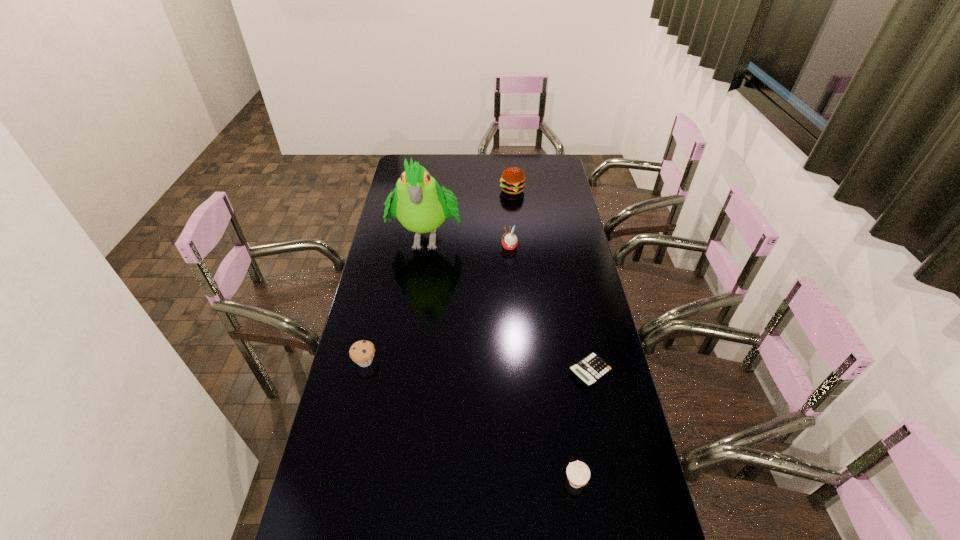
At what (x,y) coordinates should I click in order to perform the action: click on free space that satisfies the following two spatial constraints: 1. on the beak of the parakeet; 2. on the left side of the calculator. Please return your answer as a coordinate pair (x, y). This screenshot has width=960, height=540. Looking at the image, I should click on (407, 372).

Locate an element on the screen. The width and height of the screenshot is (960, 540). free location that satisfies the following two spatial constraints: 1. on the front-facing side of the second muffin from left to right; 2. on the left side of the calculator is located at coordinates (518, 372).

You are a GUI agent. You are given a task and a screenshot of the screen. Output one action in this format:
    pyautogui.click(x=<x>, y=<y>)
    Task: Click on the free location that satisfies the following two spatial constraints: 1. on the front-facing side of the farthest muffin; 2. on the right side of the calculator
    This screenshot has height=540, width=960.
    Given the screenshot: What is the action you would take?
    pyautogui.click(x=518, y=372)

I want to click on vacant region that satisfies the following two spatial constraints: 1. on the front side of the nearest object; 2. on the right side of the hamburger, so click(540, 481).

At what (x,y) coordinates should I click in order to perform the action: click on vacant position in the image that satisfies the following two spatial constraints: 1. on the back side of the leftmost muffin; 2. on the right side of the hamburger. Please return your answer as a coordinate pair (x, y). Looking at the image, I should click on (403, 190).

This screenshot has width=960, height=540. In order to click on free space that satisfies the following two spatial constraints: 1. on the front-facing side of the tallest muffin; 2. on the left side of the nearest muffin in this screenshot , I will do click(527, 481).

The image size is (960, 540). In order to click on free space that satisfies the following two spatial constraints: 1. on the beak of the calculator; 2. on the left side of the tallest object in this screenshot , I will do `click(407, 372)`.